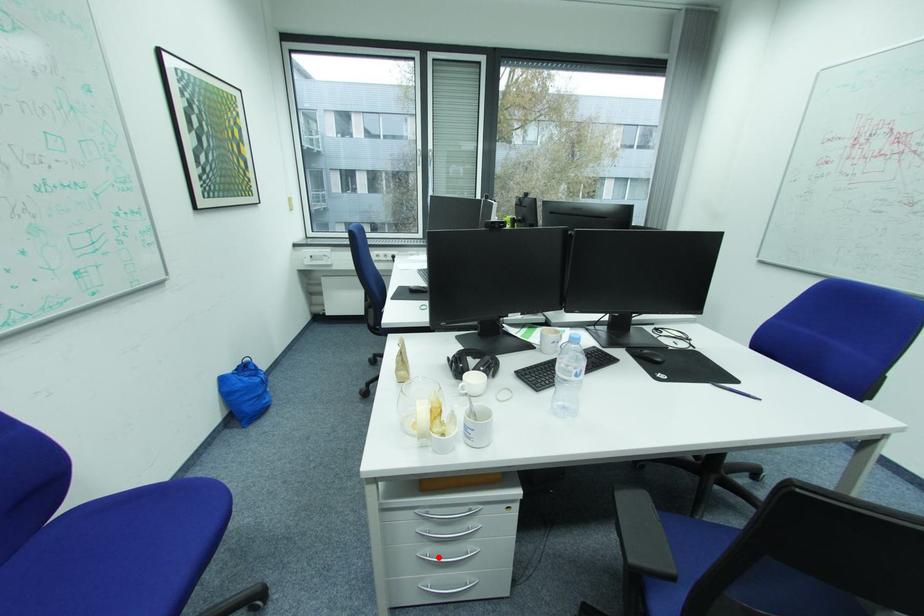
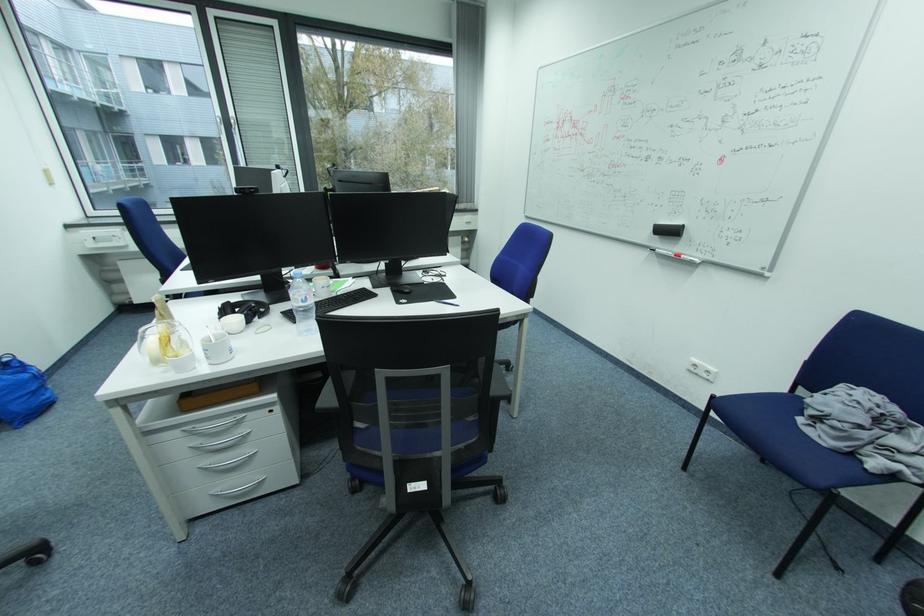
Find the pixel in the second image that matches the highlighted location in the first image.

(219, 466)